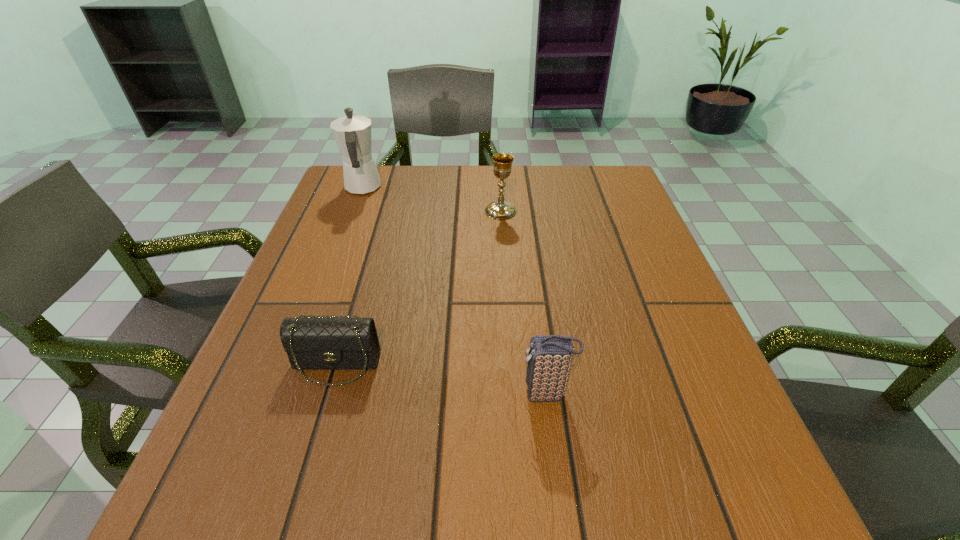
This screenshot has width=960, height=540. What are the coordinates of `free space at the far left corner of the desktop` in the screenshot? It's located at (332, 206).

The width and height of the screenshot is (960, 540). In the image, there is a desktop. Find the location of `blank space at the far right corner`. blank space at the far right corner is located at coordinates (621, 212).

I want to click on vacant region between the tallest object and the chalice, so click(432, 199).

Where is `unoccupied area between the chalice and the right clutch bag`? unoccupied area between the chalice and the right clutch bag is located at coordinates (524, 302).

I want to click on free space that is in between the shorter clutch bag and the right clutch bag, so 442,379.

This screenshot has width=960, height=540. I want to click on empty location between the shorter clutch bag and the coffeepot, so pyautogui.click(x=349, y=276).

I want to click on unoccupied area between the right clutch bag and the tallest object, so click(455, 291).

In order to click on free space between the coffeepot and the shorter clutch bag in this screenshot , I will do `click(349, 276)`.

Where is `unoccupied position between the chalice and the tallest object`? This screenshot has width=960, height=540. unoccupied position between the chalice and the tallest object is located at coordinates (432, 199).

I want to click on free space between the shortest object and the taller clutch bag, so click(442, 379).